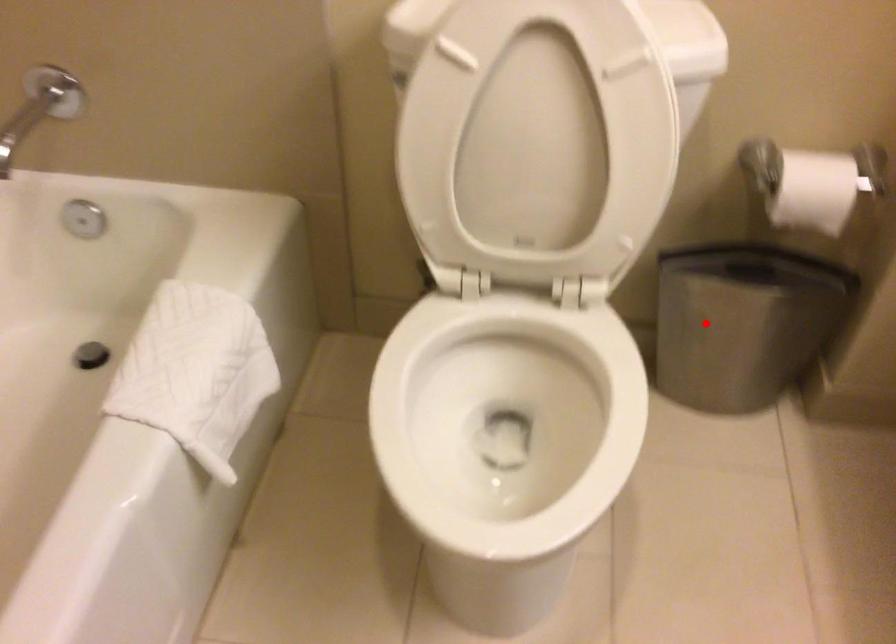
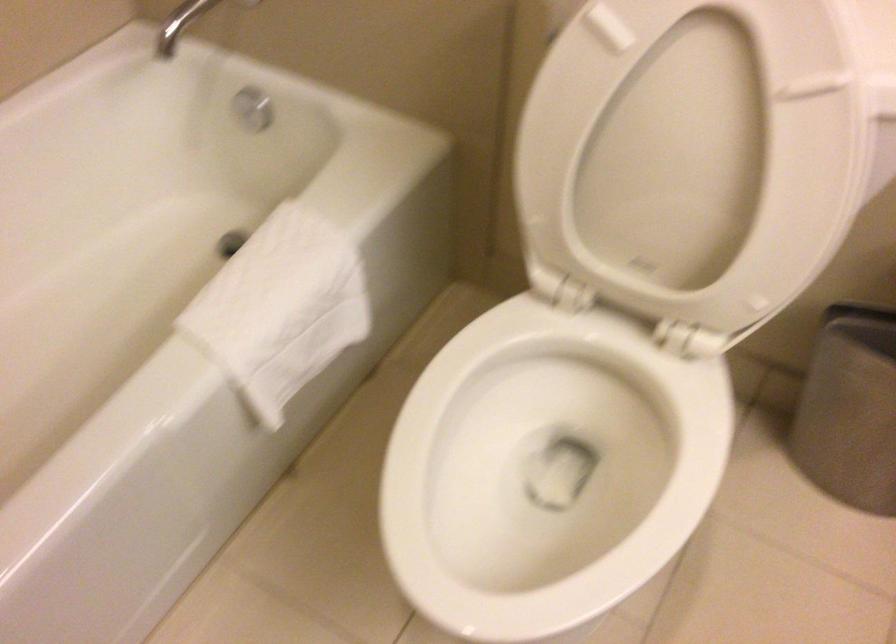
Locate, in the second image, the point that corresponds to the highlighted location in the first image.

(858, 402)